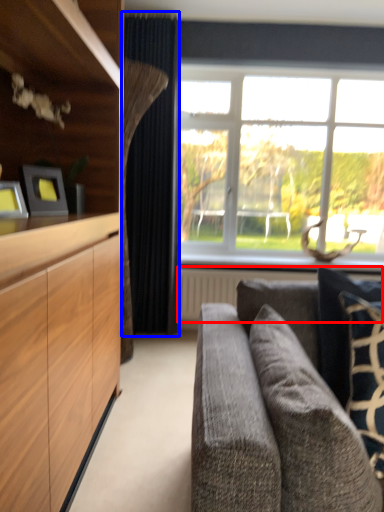
Question: Which object is closer to the camera taking this photo, radiator (highlighted by a red box) or curtain (highlighted by a blue box)?

Choices:
 (A) radiator
 (B) curtain

Answer: (B)